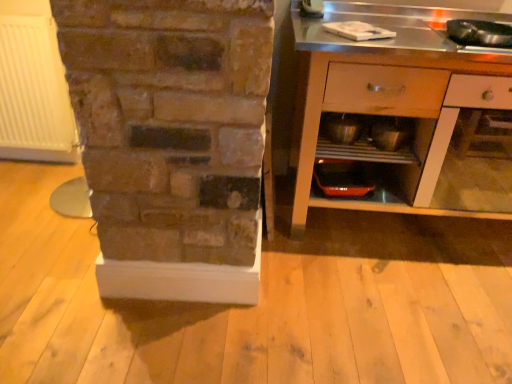
Where is `metallic silver bowl at center`? The width and height of the screenshot is (512, 384). metallic silver bowl at center is located at coordinates tap(342, 127).

Measure the distance between point (489, 53) and camera.

1.54 meters.

What do you see at coordinates (366, 138) in the screenshot? This screenshot has height=384, width=512. I see `metallic silver shelf at lower center` at bounding box center [366, 138].

The width and height of the screenshot is (512, 384). In order to click on metallic silver bowl at center in this screenshot , I will do `click(342, 127)`.

Is metallic silver cabinet at right to the left or to the right of metallic silver shelf at lower center in the image?

In the image, metallic silver cabinet at right appears on the right side of metallic silver shelf at lower center.

Between metallic silver cabinet at right and metallic silver shelf at lower center, which one has smaller size?

metallic silver shelf at lower center.

Which of these two, metallic silver cabinet at right or metallic silver shelf at lower center, stands taller?

With more height is metallic silver cabinet at right.

Between point (429, 203) and point (405, 132), which one is positioned behind?

Positioned behind is point (405, 132).

Does point (341, 134) lie behind point (53, 118)?

That is False.

Is metallic silver bowl at center bigger or smaller than white matte radiator at left?

In the image, metallic silver bowl at center appears to be smaller than white matte radiator at left.

From a real-world perspective, who is located lower, metallic silver bowl at center or white matte radiator at left?

In real-world perspective, white matte radiator at left is lower.

From the image's perspective, which object appears higher, metallic silver bowl at center or white matte radiator at left?

white matte radiator at left.

From the picture: Are white matte radiator at left and metallic silver shelf at lower center making contact?

There is a gap between white matte radiator at left and metallic silver shelf at lower center.

Which object is further away from the camera taking this photo, white matte radiator at left or metallic silver shelf at lower center?

white matte radiator at left is behind.

Is metallic silver shelf at lower center inside white matte radiator at left?

No, metallic silver shelf at lower center is not a part of white matte radiator at left.

From a real-world perspective, between white matte radiator at left and metallic silver shelf at lower center, who is vertically lower?

white matte radiator at left, from a real-world perspective.

Between metallic silver cabinet at right and metallic silver bowl at center, which one appears on the left side from the viewer's perspective?

From the viewer's perspective, metallic silver bowl at center appears more on the left side.

Can you confirm if metallic silver cabinet at right is wider than metallic silver bowl at center?

Yes, metallic silver cabinet at right is wider than metallic silver bowl at center.

The width and height of the screenshot is (512, 384). Find the location of `cabinetry below the metallic silver bowl at center (from the image's perspective)`. cabinetry below the metallic silver bowl at center (from the image's perspective) is located at coordinates point(403,112).

Is metallic silver cabinet at right oriented towards metallic silver bowl at center?

Yes, metallic silver cabinet at right faces towards metallic silver bowl at center.

Is metallic silver bowl at center taller than metallic silver shelf at lower center?

No, metallic silver bowl at center is not taller than metallic silver shelf at lower center.

In the image, there is a metallic silver bowl at center. At what (x,y) coordinates should I click in order to perform the action: click on shelf below it (from the image's perspective). Please return your answer as a coordinate pair (x, y). The height and width of the screenshot is (384, 512). Looking at the image, I should click on (366, 138).

Which is closer, (342,116) or (354,138)?

Point (354,138)

Is metallic silver shelf at lower center to the left of metallic silver cabinet at right from the viewer's perspective?

Correct, you'll find metallic silver shelf at lower center to the left of metallic silver cabinet at right.

Can you confirm if metallic silver shelf at lower center is taller than metallic silver cabinet at right?

In fact, metallic silver shelf at lower center may be shorter than metallic silver cabinet at right.

Does metallic silver shelf at lower center come in front of metallic silver cabinet at right?

No, metallic silver shelf at lower center is further to the viewer.

Between point (383, 122) and point (338, 130), which one is positioned in front?

Point (338, 130)

Is metallic silver bowl at center inside metallic silver shelf at lower center?

No, metallic silver bowl at center is not surrounded by metallic silver shelf at lower center.

You are a GUI agent. You are given a task and a screenshot of the screen. Output one action in this format:
    pyautogui.click(x=<x>, y=<y>)
    Task: Click on the shelf located on the right of metallic silver bowl at center
    
    Given the screenshot: What is the action you would take?
    pyautogui.click(x=366, y=138)

How many degrees apart are the facing directions of metallic silver shelf at lower center and metallic silver bowl at center?

2.92 degrees separate the facing orientations of metallic silver shelf at lower center and metallic silver bowl at center.

At what (x,y) coordinates should I click in order to perform the action: click on shelf located on the left of metallic silver cabinet at right. Please return your answer as a coordinate pair (x, y). This screenshot has width=512, height=384. Looking at the image, I should click on (366, 138).

The width and height of the screenshot is (512, 384). What are the coordinates of `appliance lying on the right of white matte radiator at left` in the screenshot? It's located at (342, 127).

Estimate the real-world distances between objects in this image. Which object is closer to metallic silver shelf at lower center, metallic silver cabinet at right or metallic silver bowl at center?

metallic silver bowl at center is closer to metallic silver shelf at lower center.

Looking at the image, which one is located further to metallic silver bowl at center, metallic silver shelf at lower center or metallic silver cabinet at right?

Based on the image, metallic silver cabinet at right appears to be further to metallic silver bowl at center.

Estimate the real-world distances between objects in this image. Which object is closer to metallic silver bowl at center, white matte radiator at left or metallic silver cabinet at right?

Based on the image, metallic silver cabinet at right appears to be nearer to metallic silver bowl at center.

Estimate the real-world distances between objects in this image. Which object is closer to metallic silver cabinet at right, white matte radiator at left or metallic silver bowl at center?

The object closer to metallic silver cabinet at right is metallic silver bowl at center.

Based on their spatial positions, is white matte radiator at left or metallic silver shelf at lower center further from metallic silver cabinet at right?

white matte radiator at left is further to metallic silver cabinet at right.

Which object lies nearer to the anchor point white matte radiator at left, metallic silver bowl at center or metallic silver shelf at lower center?

Among the two, metallic silver bowl at center is located nearer to white matte radiator at left.

Which object lies nearer to the anchor point metallic silver shelf at lower center, metallic silver bowl at center or metallic silver cabinet at right?

Based on the image, metallic silver bowl at center appears to be nearer to metallic silver shelf at lower center.

Considering their positions, is metallic silver cabinet at right positioned further to metallic silver bowl at center than white matte radiator at left?

white matte radiator at left lies further to metallic silver bowl at center than the other object.

I want to click on appliance between white matte radiator at left and metallic silver shelf at lower center in the horizontal direction, so click(x=342, y=127).

This screenshot has height=384, width=512. I want to click on shelf situated between white matte radiator at left and metallic silver cabinet at right from left to right, so pos(366,138).

Identify the location of shelf between metallic silver bowl at center and metallic silver cabinet at right. This screenshot has width=512, height=384. (366, 138).

You are a GUI agent. You are given a task and a screenshot of the screen. Output one action in this format:
    pyautogui.click(x=<x>, y=<y>)
    Task: Click on the appliance between white matte radiator at left and metallic silver cabinet at right in the horizontal direction
    This screenshot has width=512, height=384.
    Given the screenshot: What is the action you would take?
    pyautogui.click(x=342, y=127)